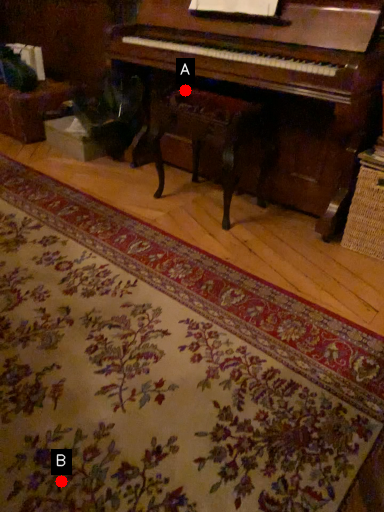
Question: Two points are circled on the image, labeled by A and B beside each circle. Which of the following is the farthest from the observer?

Choices:
 (A) A is further
 (B) B is further

Answer: (A)